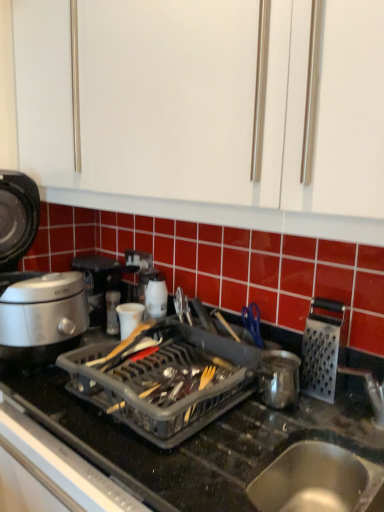
Question: Is silver metallic rice cooker at left, which is counted as the 1th kitchen appliance, starting from the left, touching shiny metallic pot at center, placed as the 4th kitchen appliance when sorted from left to right?

Choices:
 (A) no
 (B) yes

Answer: (A)

Question: Is silver metallic rice cooker at left, the 5th kitchen appliance when ordered from right to left, aimed at shiny metallic pot at center, the second kitchen appliance in the right-to-left sequence?

Choices:
 (A) yes
 (B) no

Answer: (A)

Question: Can you confirm if silver metallic rice cooker at left, the 5th kitchen appliance when ordered from right to left, is taller than shiny metallic pot at center, placed as the 4th kitchen appliance when sorted from left to right?

Choices:
 (A) yes
 (B) no

Answer: (A)

Question: Is shiny metallic pot at center, placed as the 4th kitchen appliance when sorted from left to right, completely or partially inside silver metallic rice cooker at left, the 5th kitchen appliance when ordered from right to left?

Choices:
 (A) yes
 (B) no

Answer: (B)

Question: Considering the relative positions of silver metallic rice cooker at left, which is counted as the 1th kitchen appliance, starting from the left, and shiny metallic pot at center, the second kitchen appliance in the right-to-left sequence, in the image provided, is silver metallic rice cooker at left, which is counted as the 1th kitchen appliance, starting from the left, to the left of shiny metallic pot at center, the second kitchen appliance in the right-to-left sequence, from the viewer's perspective?

Choices:
 (A) yes
 (B) no

Answer: (A)

Question: From the image's perspective, is silver metallic rice cooker at left, which is counted as the 1th kitchen appliance, starting from the left, located above or below white plastic kettle at center, the 3th kitchen appliance positioned from the right?

Choices:
 (A) above
 (B) below

Answer: (A)

Question: Choose the correct answer: Is silver metallic rice cooker at left, the 5th kitchen appliance when ordered from right to left, inside white plastic kettle at center, the 3th kitchen appliance positioned from the right, or outside it?

Choices:
 (A) outside
 (B) inside

Answer: (A)

Question: Does point (46, 325) appear closer or farther from the camera than point (147, 293)?

Choices:
 (A) farther
 (B) closer

Answer: (B)

Question: Based on their sizes in the image, would you say silver metallic rice cooker at left, the 5th kitchen appliance when ordered from right to left, is bigger or smaller than white plastic kettle at center, acting as the 3th kitchen appliance starting from the left?

Choices:
 (A) small
 (B) big

Answer: (B)

Question: Is silver metallic grater at right, which ranks as the 1th kitchen appliance in right-to-left order, bigger or smaller than black plastic dish rack at center?

Choices:
 (A) small
 (B) big

Answer: (A)

Question: From a real-world perspective, is silver metallic grater at right, which ranks as the 1th kitchen appliance in right-to-left order, positioned above or below black plastic dish rack at center?

Choices:
 (A) above
 (B) below

Answer: (A)

Question: Is point (344, 332) positioned closer to the camera than point (355, 442)?

Choices:
 (A) farther
 (B) closer

Answer: (A)

Question: In terms of width, does silver metallic grater at right, positioned as the fifth kitchen appliance in left-to-right order, look wider or thinner when compared to black plastic dish rack at center?

Choices:
 (A) thin
 (B) wide

Answer: (A)

Question: From the image's perspective, is silver metallic grater at right, which ranks as the 1th kitchen appliance in right-to-left order, above or below shiny metallic pot at center, placed as the 4th kitchen appliance when sorted from left to right?

Choices:
 (A) above
 (B) below

Answer: (A)

Question: Choose the correct answer: Is silver metallic grater at right, positioned as the fifth kitchen appliance in left-to-right order, inside shiny metallic pot at center, placed as the 4th kitchen appliance when sorted from left to right, or outside it?

Choices:
 (A) outside
 (B) inside

Answer: (A)